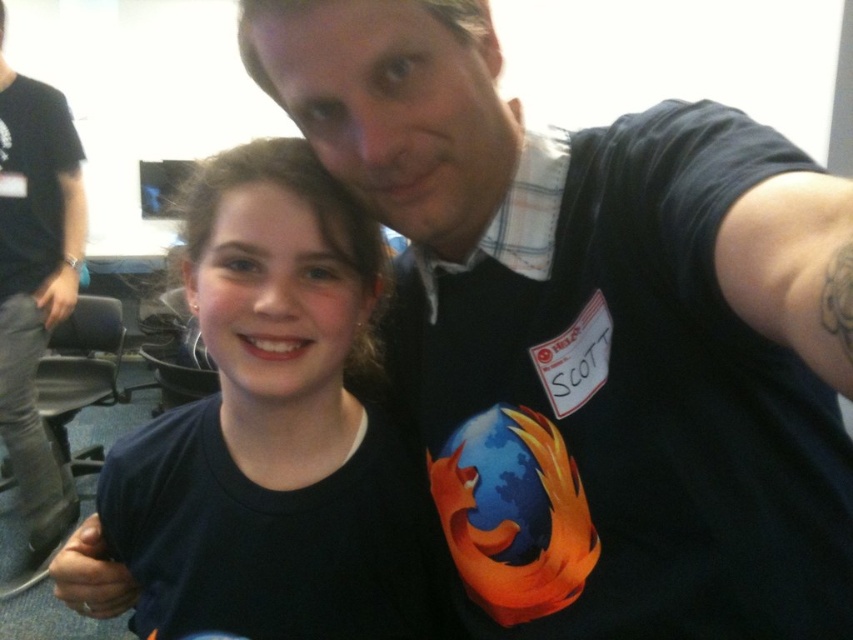
In the scene shown: Does black matte t-shirt at upper center appear over plaid fabric shirt at upper center?

Actually, black matte t-shirt at upper center is below plaid fabric shirt at upper center.

Is point (735, 609) positioned before point (550, 204)?

Yes, it is.

Describe the element at coordinates (593, 332) in the screenshot. I see `black matte t-shirt at upper center` at that location.

Locate an element on the screen. black matte t-shirt at upper center is located at coordinates (593, 332).

Who is shorter, dark blue t-shirt at center or plaid fabric shirt at upper center?

Standing shorter between the two is plaid fabric shirt at upper center.

Who is taller, dark blue t-shirt at center or plaid fabric shirt at upper center?

Standing taller between the two is dark blue t-shirt at center.

Is point (323, 321) positioned after point (537, 266)?

That is True.

This screenshot has width=853, height=640. I want to click on dark blue t-shirt at center, so click(x=276, y=429).

Is dark blue t-shirt at center thinner than black t-shirt at upper right?

No.

Who is higher up, dark blue t-shirt at center or black t-shirt at upper right?

black t-shirt at upper right

Between point (109, 547) and point (47, 86), which one is positioned behind?

Point (47, 86)

Identify the location of dark blue t-shirt at center. (276, 429).